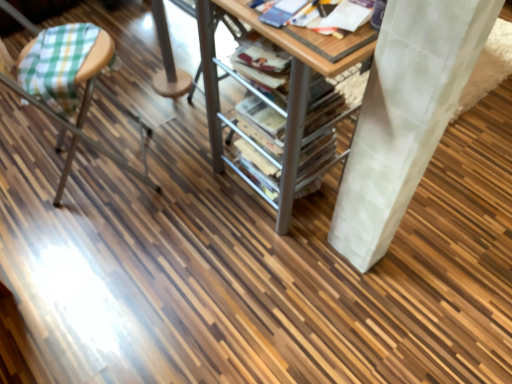
Where is `free space to the left of green plaid fabric stool at left`? free space to the left of green plaid fabric stool at left is located at coordinates (26, 167).